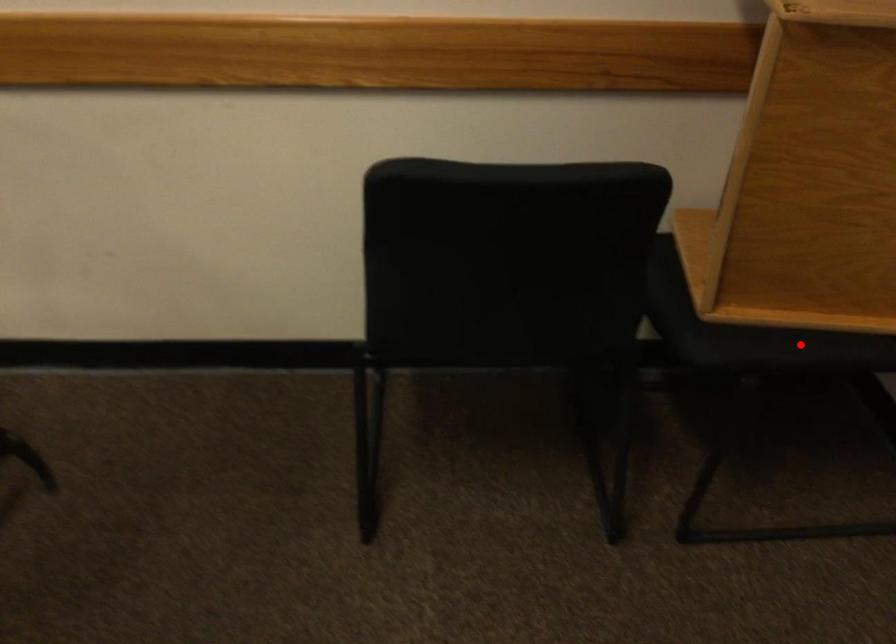
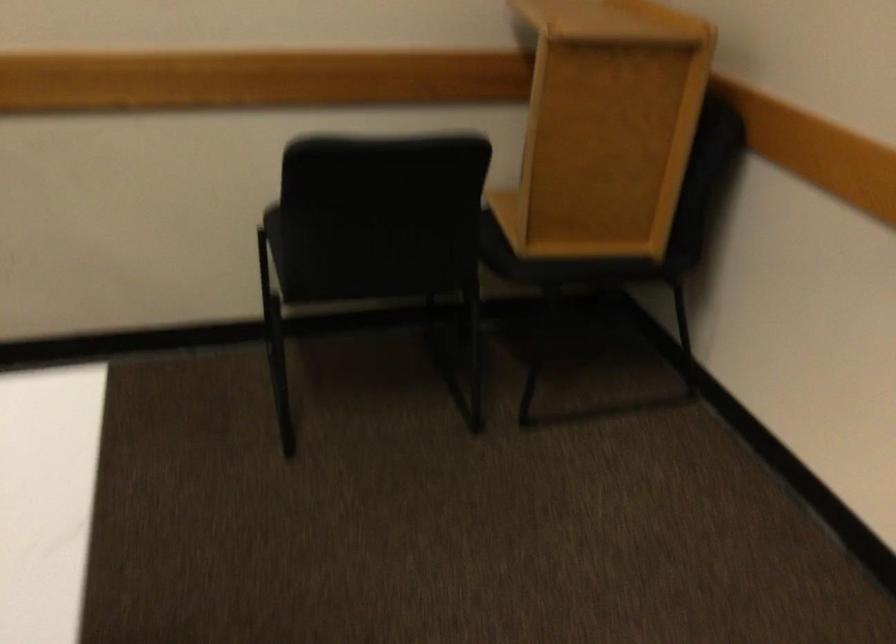
The point at the highlighted location is marked in the first image. Where is the corresponding point in the second image?

(586, 263)